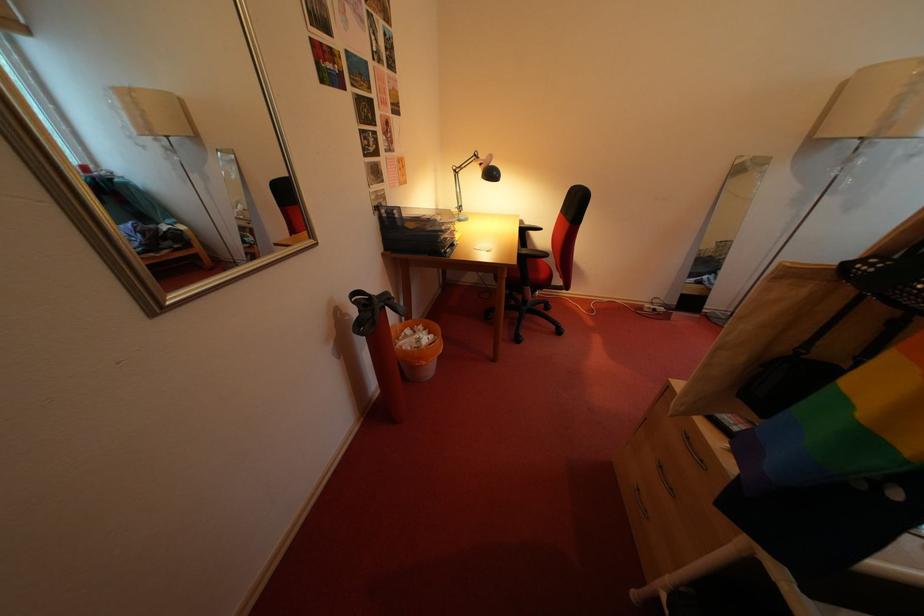
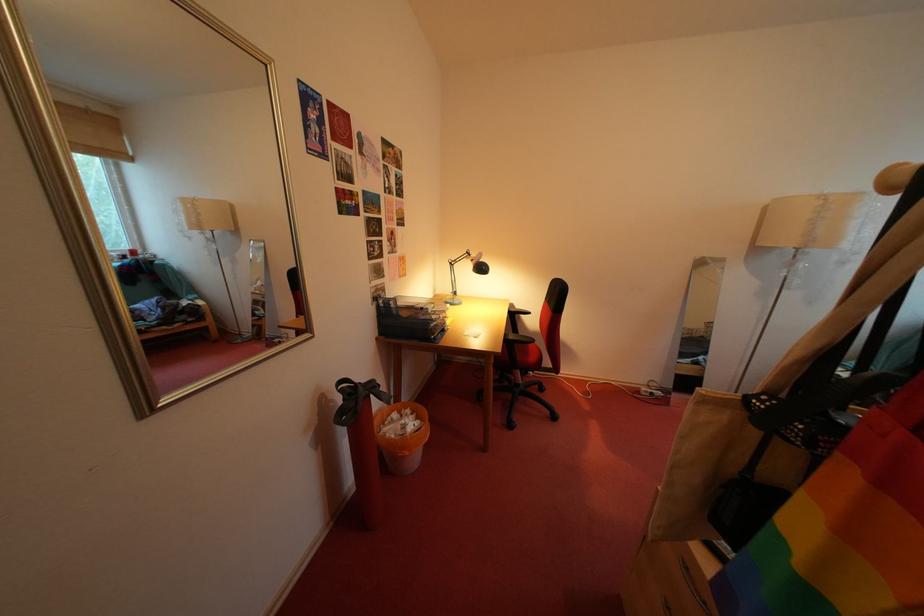
Question: The first image is from the beginning of the video and the second image is from the end. How did the camera likely rotate when shooting the video?

Choices:
 (A) Left
 (B) Right
 (C) Up
 (D) Down

Answer: (C)